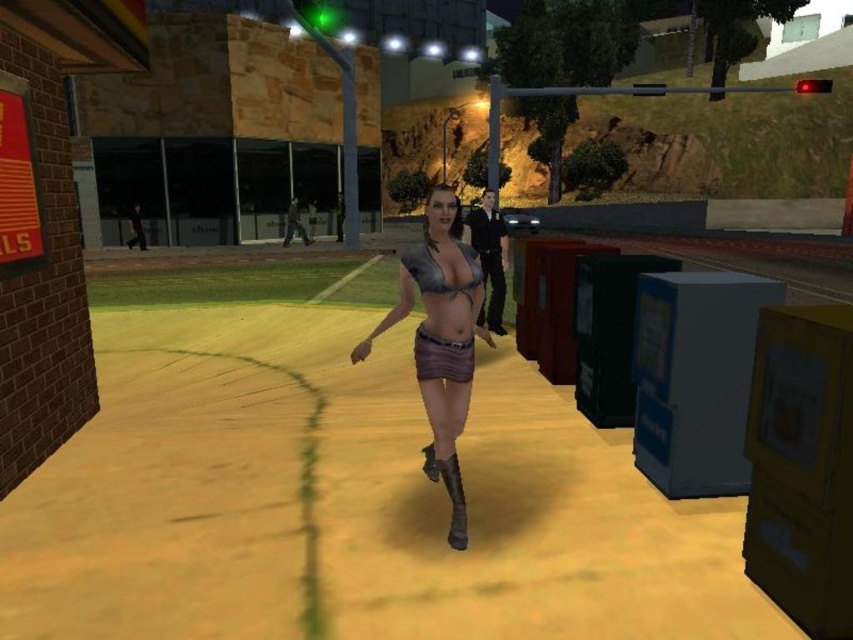
Question: Among these points, which one is nearest to the camera?

Choices:
 (A) (434, 372)
 (B) (468, 349)

Answer: (A)

Question: Is shiny metallic bra at center smaller than matte metallic bikini top at center?

Choices:
 (A) yes
 (B) no

Answer: (B)

Question: Does shiny metallic bra at center come behind matte metallic bikini top at center?

Choices:
 (A) yes
 (B) no

Answer: (B)

Question: Estimate the real-world distances between objects in this image. Which object is closer to the matte metallic bikini top at center?

Choices:
 (A) brown fabric skirt at center
 (B) shiny metallic bra at center

Answer: (A)

Question: Is shiny metallic bra at center in front of brown fabric skirt at center?

Choices:
 (A) no
 (B) yes

Answer: (B)

Question: Which point is closer to the camera taking this photo?

Choices:
 (A) (434, 352)
 (B) (451, 365)
 (C) (422, 266)

Answer: (C)